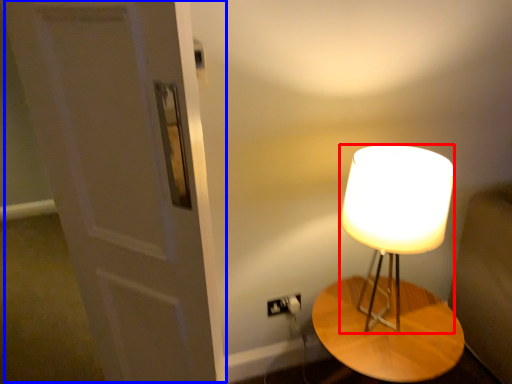
Question: Among these objects, which one is farthest to the camera, lamp (highlighted by a red box) or door (highlighted by a blue box)?

Choices:
 (A) lamp
 (B) door

Answer: (A)